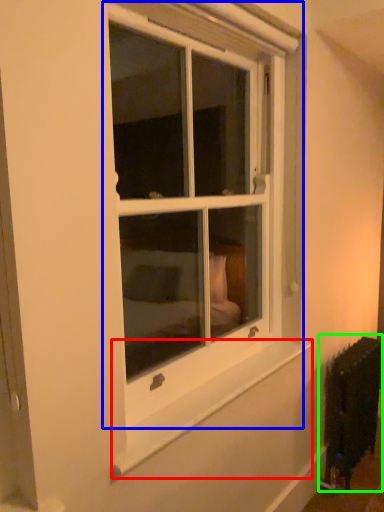
Question: Which is nearer to the window sill (highlighted by a red box)? window (highlighted by a blue box) or radiator (highlighted by a green box).

Choices:
 (A) window
 (B) radiator

Answer: (B)